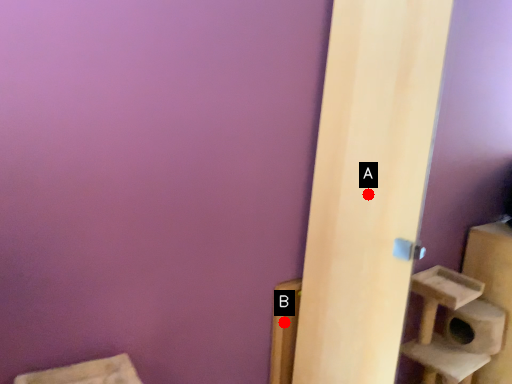
Question: Two points are circled on the image, labeled by A and B beside each circle. Among these points, which one is farthest from the camera?

Choices:
 (A) A is further
 (B) B is further

Answer: (B)